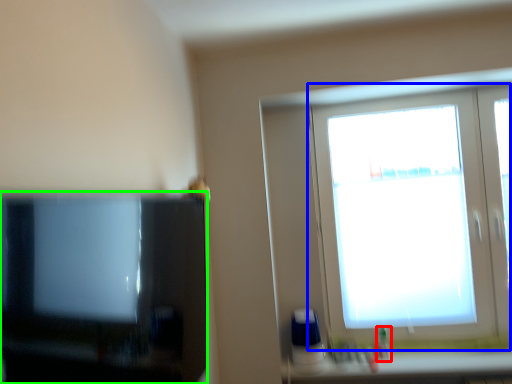
Question: Which is nearer to the toiletry (highlighted by a red box)? window (highlighted by a blue box) or television (highlighted by a green box).

Choices:
 (A) window
 (B) television

Answer: (A)